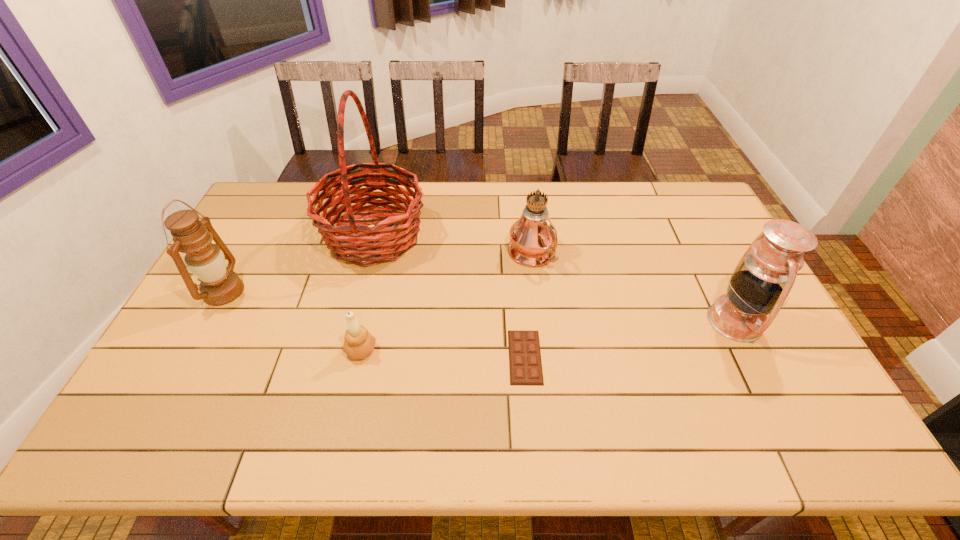
Identify the location of vacant space located 0.320m on the right of the leftmost object. (350, 291).

The width and height of the screenshot is (960, 540). In order to click on vacant position located 0.400m on the back of the second shortest object in this screenshot , I will do `click(386, 240)`.

The height and width of the screenshot is (540, 960). I want to click on vacant space situated 0.290m on the left of the shortest object, so click(397, 357).

Where is `object at the far edge`? object at the far edge is located at coordinates (360, 244).

Identify the location of object situated at the left edge. The image size is (960, 540). (205, 260).

I want to click on object present at the right edge, so click(x=763, y=278).

Find the location of `vacant region at the far edge`. vacant region at the far edge is located at coordinates (620, 199).

Where is `vacant space at the left edge of the desktop`? The width and height of the screenshot is (960, 540). vacant space at the left edge of the desktop is located at coordinates (213, 310).

This screenshot has height=540, width=960. In the image, there is a desktop. What are the coordinates of `free space at the right edge` in the screenshot? It's located at (709, 272).

You are a GUI agent. You are given a task and a screenshot of the screen. Output one action in this format:
    pyautogui.click(x=<x>, y=<y>)
    Task: Click on the vacant region at the far left corner
    The width and height of the screenshot is (960, 540).
    Given the screenshot: What is the action you would take?
    point(300,197)